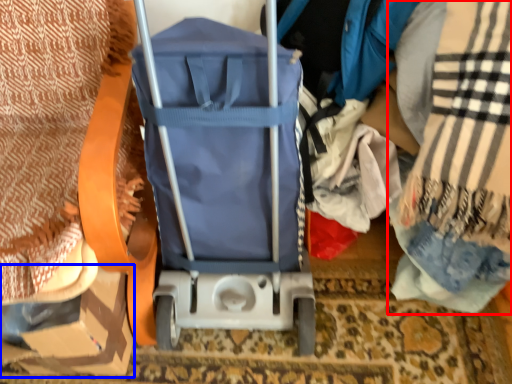
Question: Which object is closer to the camera taking this photo, blanket (highlighted by a red box) or cardboard box (highlighted by a blue box)?

Choices:
 (A) blanket
 (B) cardboard box

Answer: (A)